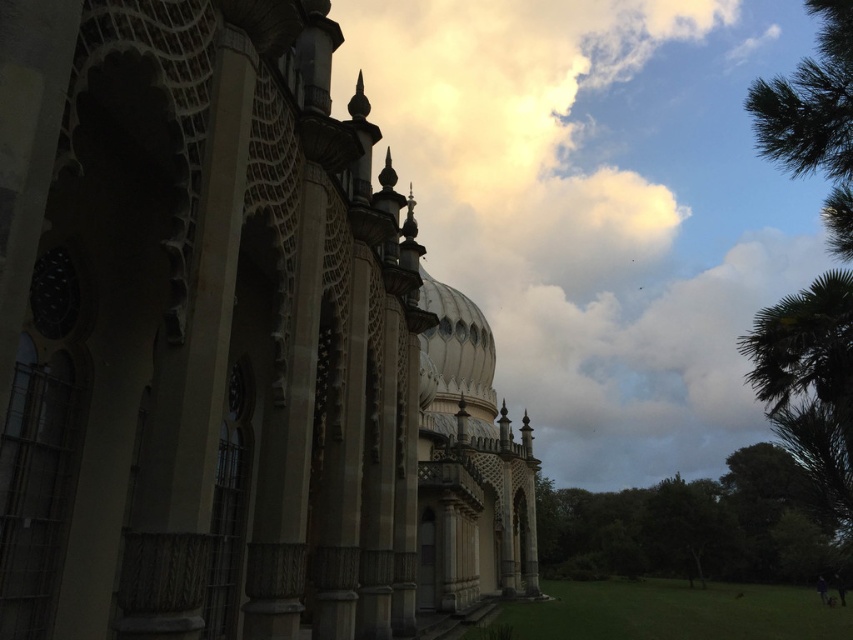
Is green leafy palm tree at upper right above white textured dome at center?

Yes, green leafy palm tree at upper right is above white textured dome at center.

You are a GUI agent. You are given a task and a screenshot of the screen. Output one action in this format:
    pyautogui.click(x=<x>, y=<y>)
    Task: Click on the green leafy palm tree at upper right
    This screenshot has height=640, width=853.
    Given the screenshot: What is the action you would take?
    pyautogui.click(x=814, y=116)

The height and width of the screenshot is (640, 853). What are the coordinates of `green leafy palm tree at upper right` in the screenshot? It's located at (814, 116).

Is point (158, 17) behind point (843, 154)?

No, it is not.

Is stone mosaic palace at center wider than green leafy palm tree at upper right?

No.

Does point (415, 260) come in front of point (846, 35)?

No, it is not.

The width and height of the screenshot is (853, 640). What are the coordinates of `stone mosaic palace at center` in the screenshot? It's located at (224, 346).

Who is more forward, (701, 544) or (450, 355)?

Point (450, 355) is more forward.

Is green leafy tree at lower right to the right of white textured dome at center from the viewer's perspective?

Correct, you'll find green leafy tree at lower right to the right of white textured dome at center.

Is point (720, 492) farther from viewer compared to point (482, 321)?

Yes, it is.

Image resolution: width=853 pixels, height=640 pixels. I want to click on green leafy tree at lower right, so click(x=694, y=525).